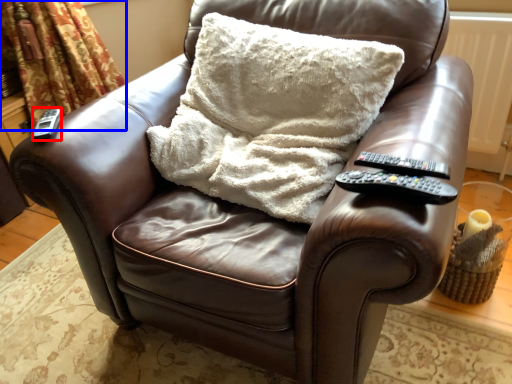
Question: Which object appears closest to the camera in this image, remote (highlighted by a red box) or curtain (highlighted by a blue box)?

Choices:
 (A) remote
 (B) curtain

Answer: (A)